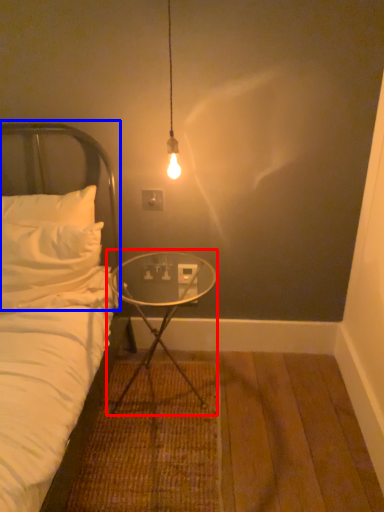
Question: Which point is closer to the camera, table (highlighted by a red box) or headboard (highlighted by a blue box)?

Choices:
 (A) table
 (B) headboard

Answer: (A)